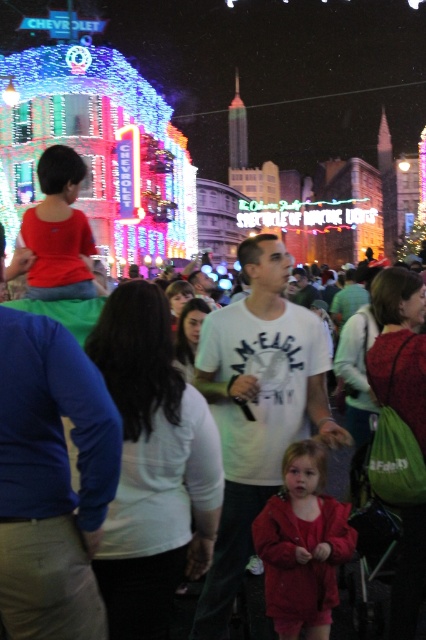
Is white cotton shirt at center shorter than matte red coat at center?

No, white cotton shirt at center is not shorter than matte red coat at center.

Which is in front, point (203, 378) or point (310, 536)?

Positioned in front is point (310, 536).

Is point (241, 385) closer to viewer compared to point (288, 529)?

No, (241, 385) is behind (288, 529).

Where is `white cotton shirt at center`? white cotton shirt at center is located at coordinates 137,358.